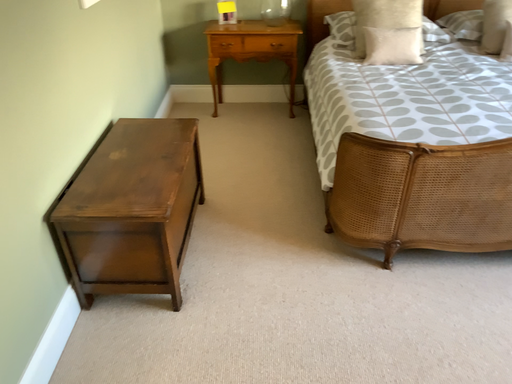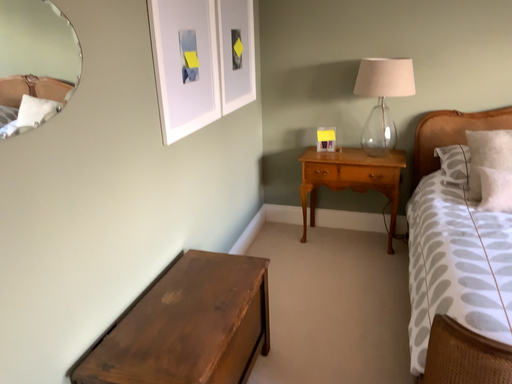
Question: Which way did the camera rotate in the video?

Choices:
 (A) rotated right
 (B) rotated left

Answer: (B)